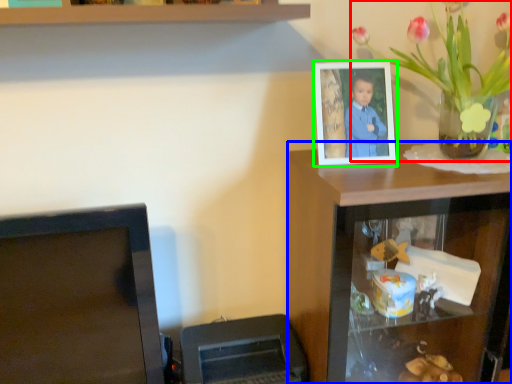
Question: Based on their relative distances, which object is nearer to houseplant (highlighted by a red box)? Choose from computer desk (highlighted by a blue box) and picture frame (highlighted by a green box).

Choices:
 (A) computer desk
 (B) picture frame

Answer: (B)